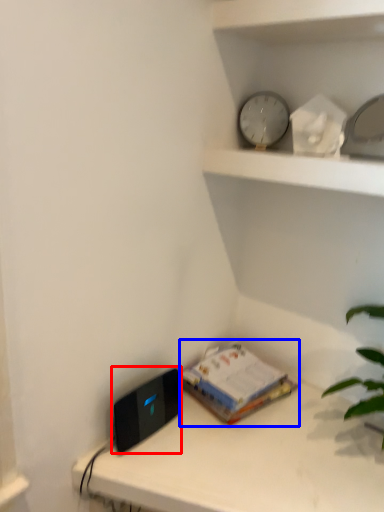
Question: Which of the following is the farthest to the observer, ipod (highlighted by a red box) or paperback book (highlighted by a blue box)?

Choices:
 (A) ipod
 (B) paperback book

Answer: (B)